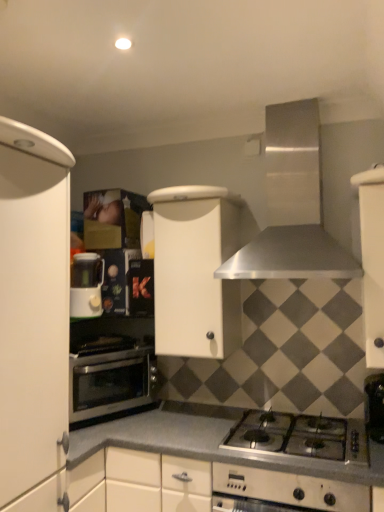
Identify the location of white matte cabinet at center, the second cabinetry when ordered from right to left. (195, 271).

Describe the element at coordinates (33, 315) in the screenshot. Image resolution: width=384 pixels, height=512 pixels. I see `white matte cabinet at left, the 3th cabinetry when ordered from right to left` at that location.

Locate an element on the screen. Image resolution: width=384 pixels, height=512 pixels. white plastic coffee machine at left is located at coordinates (86, 285).

The image size is (384, 512). Describe the element at coordinates (110, 375) in the screenshot. I see `stainless steel oven at lower left` at that location.

The image size is (384, 512). What do you see at coordinates (372, 260) in the screenshot? I see `white matte cabinet at right, marked as the 3th cabinetry in a left-to-right arrangement` at bounding box center [372, 260].

Where is `white matte cabinet at center, placed as the 2th cabinetry when sorted from left to right`? This screenshot has height=512, width=384. white matte cabinet at center, placed as the 2th cabinetry when sorted from left to right is located at coordinates (195, 271).

Which is nearer, (x=83, y=270) or (x=370, y=170)?

Point (x=83, y=270) is farther from the camera than point (x=370, y=170).

Does white plastic coffee machine at left appear on the left side of white matte cabinet at right, which is the first cabinetry from right to left?

Indeed, white plastic coffee machine at left is positioned on the left side of white matte cabinet at right, which is the first cabinetry from right to left.

Is white matte cabinet at right, which is the first cabinetry from right to left, at the back of white plastic coffee machine at left?

No, white matte cabinet at right, which is the first cabinetry from right to left, is not at the back of white plastic coffee machine at left.

Is white matte cabinet at right, marked as the 3th cabinetry in a left-to-right arrangement, completely or partially inside white plastic coffee machine at left?

No, white matte cabinet at right, marked as the 3th cabinetry in a left-to-right arrangement, is located outside of white plastic coffee machine at left.

How many degrees apart are the facing directions of smooth gray countertop at center and stainless steel range hood at upper center?

The facing directions of smooth gray countertop at center and stainless steel range hood at upper center are 0.449 degrees apart.

From a real-world perspective, is smooth gray countertop at center above or below stainless steel range hood at upper center?

In terms of real-world spatial position, smooth gray countertop at center is below stainless steel range hood at upper center.

From the image's perspective, would you say smooth gray countertop at center is positioned over stainless steel range hood at upper center?

No, from the image's perspective, smooth gray countertop at center is not over stainless steel range hood at upper center.

What are the coordinates of `countertop on the left of the stainless steel range hood at upper center` in the screenshot? It's located at (207, 442).

Considering the sizes of objects white plastic coffee machine at left and silver metallic gas stove at lower center in the image provided, who is bigger, white plastic coffee machine at left or silver metallic gas stove at lower center?

silver metallic gas stove at lower center.

Are white plastic coffee machine at left and silver metallic gas stove at lower center far apart?

white plastic coffee machine at left is far away from silver metallic gas stove at lower center.

Between point (89, 297) and point (319, 451), which one is positioned behind?

The point (89, 297) is behind.

Does white plastic coffee machine at left have a lesser width compared to silver metallic gas stove at lower center?

Indeed, white plastic coffee machine at left has a lesser width compared to silver metallic gas stove at lower center.

Considering their positions, is stainless steel oven at lower left located in front of or behind stainless steel range hood at upper center?

stainless steel oven at lower left is behind stainless steel range hood at upper center.

From a real-world perspective, is stainless steel oven at lower left physically below stainless steel range hood at upper center?

Yes.

Considering the sizes of objects stainless steel oven at lower left and stainless steel range hood at upper center in the image provided, who is wider, stainless steel oven at lower left or stainless steel range hood at upper center?

stainless steel range hood at upper center.

Locate an element on the screen. oven in front of the white plastic coffee machine at left is located at coordinates point(110,375).

Does point (97, 294) come closer to viewer compared to point (145, 388)?

Yes, point (97, 294) is closer to viewer.

Is stainless steel oven at lower left at the back of white plastic coffee machine at left?

No, white plastic coffee machine at left is not facing away from stainless steel oven at lower left.

In terms of width, does white matte cabinet at left, marked as the 1th cabinetry in a left-to-right arrangement, look wider or thinner when compared to white matte cabinet at center, the second cabinetry when ordered from right to left?

In the image, white matte cabinet at left, marked as the 1th cabinetry in a left-to-right arrangement, appears to be wider than white matte cabinet at center, the second cabinetry when ordered from right to left.

Is the depth of white matte cabinet at left, marked as the 1th cabinetry in a left-to-right arrangement, less than that of white matte cabinet at center, the second cabinetry when ordered from right to left?

Yes, white matte cabinet at left, marked as the 1th cabinetry in a left-to-right arrangement, is in front of white matte cabinet at center, the second cabinetry when ordered from right to left.

Image resolution: width=384 pixels, height=512 pixels. I want to click on cabinetry that is the 1st one when counting upward from the white matte cabinet at left, marked as the 1th cabinetry in a left-to-right arrangement (from the image's perspective), so click(x=195, y=271).

Is stainless steel oven at lower left at the back of white matte cabinet at left, the 3th cabinetry when ordered from right to left?

No.

Which is behind, point (71, 158) or point (85, 392)?

The point (85, 392) is more distant.

From the image's perspective, which is below, white matte cabinet at left, marked as the 1th cabinetry in a left-to-right arrangement, or stainless steel oven at lower left?

From the image's view, stainless steel oven at lower left is below.

This screenshot has width=384, height=512. I want to click on coffee machine that appears on the left of white matte cabinet at right, which is the first cabinetry from right to left, so click(86, 285).

Locate an element on the screen. The height and width of the screenshot is (512, 384). countertop beneath the stainless steel range hood at upper center (from a real-world perspective) is located at coordinates (207, 442).

Estimate the real-world distances between objects in this image. Which object is closer to white plastic coffee machine at left, smooth gray countertop at center or white matte cabinet at right, marked as the 3th cabinetry in a left-to-right arrangement?

smooth gray countertop at center lies closer to white plastic coffee machine at left than the other object.

Which object lies nearer to the anchor point silver metallic gas stove at lower center, white matte cabinet at right, which is the first cabinetry from right to left, or white matte cabinet at left, the 3th cabinetry when ordered from right to left?

Among the two, white matte cabinet at right, which is the first cabinetry from right to left, is located nearer to silver metallic gas stove at lower center.

Which object lies further to the anchor point white matte cabinet at left, marked as the 1th cabinetry in a left-to-right arrangement, stainless steel range hood at upper center or smooth gray countertop at center?

stainless steel range hood at upper center lies further to white matte cabinet at left, marked as the 1th cabinetry in a left-to-right arrangement, than the other object.

Based on their spatial positions, is stainless steel range hood at upper center or white matte cabinet at center, the second cabinetry when ordered from right to left, further from white matte cabinet at left, marked as the 1th cabinetry in a left-to-right arrangement?

stainless steel range hood at upper center is further to white matte cabinet at left, marked as the 1th cabinetry in a left-to-right arrangement.

From the image, which object appears to be nearer to white matte cabinet at left, the 3th cabinetry when ordered from right to left, smooth gray countertop at center or white plastic coffee machine at left?

white plastic coffee machine at left lies closer to white matte cabinet at left, the 3th cabinetry when ordered from right to left, than the other object.

From the image, which object appears to be nearer to stainless steel oven at lower left, stainless steel range hood at upper center or smooth gray countertop at center?

Based on the image, smooth gray countertop at center appears to be nearer to stainless steel oven at lower left.

Considering their positions, is smooth gray countertop at center positioned further to white matte cabinet at center, placed as the 2th cabinetry when sorted from left to right, than white matte cabinet at right, marked as the 3th cabinetry in a left-to-right arrangement?

white matte cabinet at right, marked as the 3th cabinetry in a left-to-right arrangement, is further to white matte cabinet at center, placed as the 2th cabinetry when sorted from left to right.

Looking at this image, which object lies nearer to the anchor point stainless steel range hood at upper center, white matte cabinet at right, which is the first cabinetry from right to left, or stainless steel oven at lower left?

white matte cabinet at right, which is the first cabinetry from right to left, is positioned closer to the anchor stainless steel range hood at upper center.

Where is `oven located between white plastic coffee machine at left and stainless steel range hood at upper center in the left-right direction`? This screenshot has height=512, width=384. oven located between white plastic coffee machine at left and stainless steel range hood at upper center in the left-right direction is located at coordinates pos(110,375).

Locate an element on the screen. The image size is (384, 512). gas stove between white matte cabinet at center, the second cabinetry when ordered from right to left, and smooth gray countertop at center in the up-down direction is located at coordinates (298, 437).

Where is `cabinetry between white matte cabinet at center, placed as the 2th cabinetry when sorted from left to right, and smooth gray countertop at center vertically`? cabinetry between white matte cabinet at center, placed as the 2th cabinetry when sorted from left to right, and smooth gray countertop at center vertically is located at coordinates (33, 315).

Locate an element on the screen. oven between white matte cabinet at left, the 3th cabinetry when ordered from right to left, and white plastic coffee machine at left from front to back is located at coordinates (110, 375).